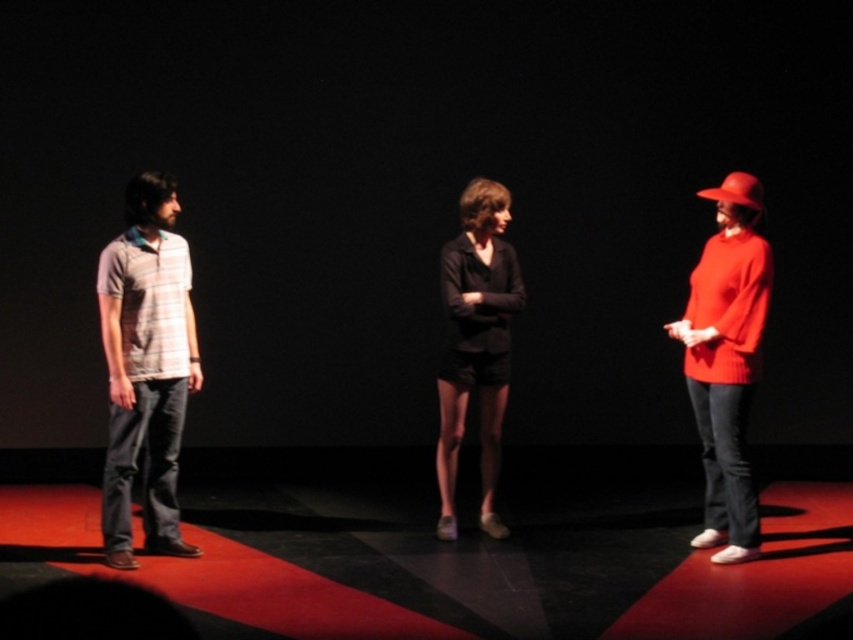
Question: Which point is farther from the camera taking this photo?

Choices:
 (A) (723, 276)
 (B) (473, 300)
 (C) (126, 288)

Answer: (B)

Question: Does striped cotton polo shirt at left appear under black matte shorts at center?

Choices:
 (A) yes
 (B) no

Answer: (A)

Question: Which point is farther from the camera taking this photo?

Choices:
 (A) (476, 353)
 (B) (735, 369)
 (C) (117, 349)

Answer: (A)

Question: Which object is farther from the camera taking this photo?

Choices:
 (A) striped cotton polo shirt at left
 (B) matte red sweater at right
 (C) black matte shorts at center

Answer: (C)

Question: Can you confirm if striped cotton polo shirt at left is positioned to the right of matte red sweater at right?

Choices:
 (A) yes
 (B) no

Answer: (B)

Question: Does matte red sweater at right appear on the right side of black matte shorts at center?

Choices:
 (A) no
 (B) yes

Answer: (B)